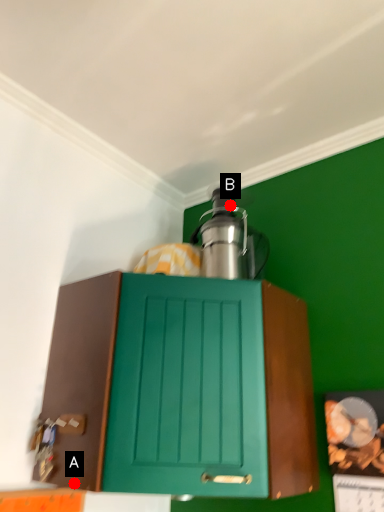
Question: Two points are circled on the image, labeled by A and B beside each circle. Which point is closer to the camera?

Choices:
 (A) A is closer
 (B) B is closer

Answer: (A)